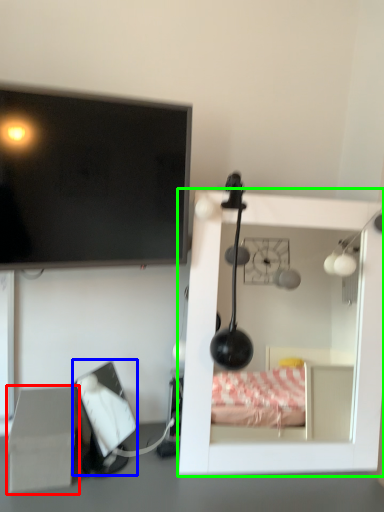
Question: Which object is positioned closest to cardboard box (highlighted by a red box)? Select from computer monitor (highlighted by a blue box) and furniture (highlighted by a green box).

Choices:
 (A) computer monitor
 (B) furniture

Answer: (A)